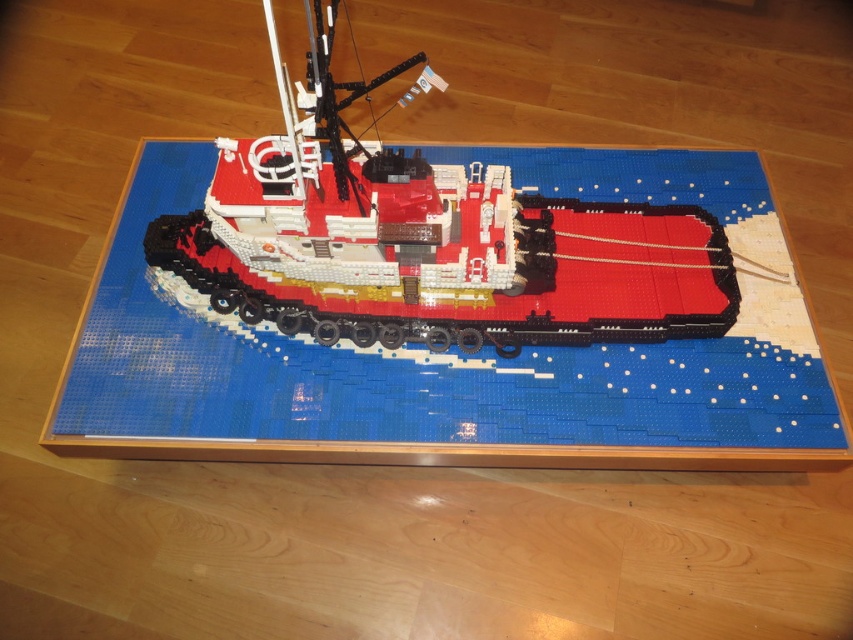
Question: Among these objects, which one is farthest from the camera?

Choices:
 (A) brick red plastic tugboat at center
 (B) blue plastic table at center

Answer: (B)

Question: Considering the relative positions of blue plastic table at center and brick red plastic tugboat at center in the image provided, where is blue plastic table at center located with respect to brick red plastic tugboat at center?

Choices:
 (A) below
 (B) above

Answer: (A)

Question: Can you confirm if blue plastic table at center is positioned above brick red plastic tugboat at center?

Choices:
 (A) no
 (B) yes

Answer: (A)

Question: Among these objects, which one is farthest from the camera?

Choices:
 (A) brick red plastic tugboat at center
 (B) blue plastic table at center

Answer: (B)

Question: Which of the following is the closest to the observer?

Choices:
 (A) (604, 168)
 (B) (399, 216)

Answer: (B)

Question: Does blue plastic table at center appear on the left side of brick red plastic tugboat at center?

Choices:
 (A) no
 (B) yes

Answer: (B)